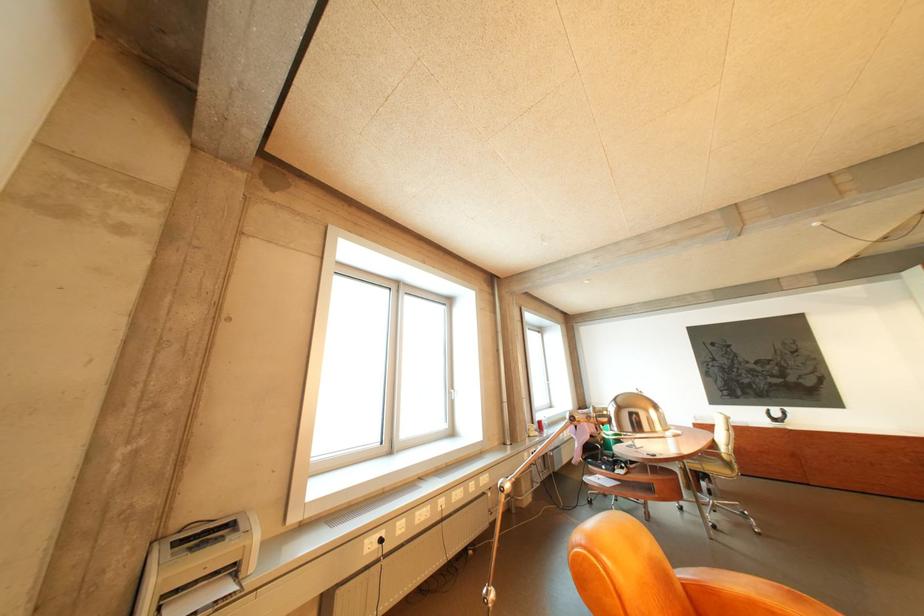
Find the location of a particular element. red bottle is located at coordinates (540, 427).